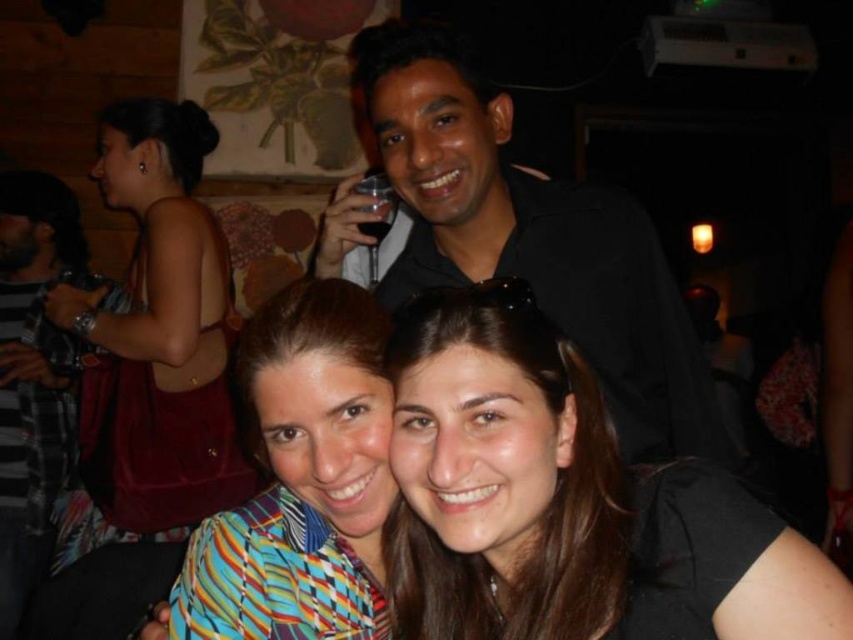
Is point (51, 227) closer to camera compared to point (387, 202)?

No.

Between brushed metal shirt at upper center and transparent plastic wine glass at upper center, which one is positioned higher?

transparent plastic wine glass at upper center

Where is `brushed metal shirt at upper center`? This screenshot has width=853, height=640. brushed metal shirt at upper center is located at coordinates (33, 376).

In order to click on brushed metal shirt at upper center in this screenshot , I will do `click(33, 376)`.

Does black matte hair at center appear over brushed metal shirt at upper center?

No.

Does black matte hair at center have a greater height compared to brushed metal shirt at upper center?

No.

Where is `black matte hair at center`? Image resolution: width=853 pixels, height=640 pixels. black matte hair at center is located at coordinates (566, 500).

Between point (407, 352) and point (376, 282), which one is positioned behind?

The point (376, 282) is behind.

Locate an element on the screen. This screenshot has width=853, height=640. black matte hair at center is located at coordinates (566, 500).

Locate an element on the screen. This screenshot has width=853, height=640. black matte hair at center is located at coordinates (566, 500).